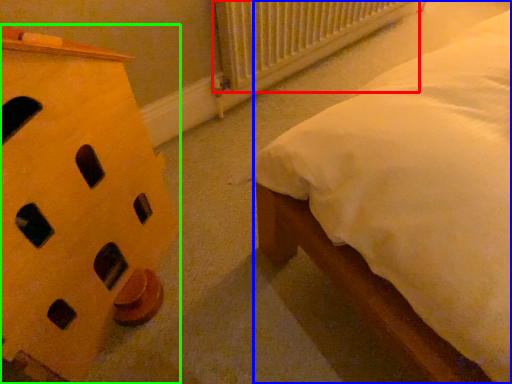
Question: Which object is the closest to the radiator (highlighted by a red box)? Choose among these: nightstand (highlighted by a blue box) or furniture (highlighted by a green box).

Choices:
 (A) nightstand
 (B) furniture

Answer: (A)